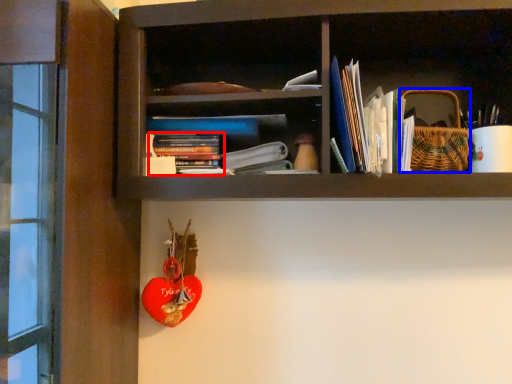
Question: Which point is closer to the camera, book (highlighted by a red box) or basket (highlighted by a blue box)?

Choices:
 (A) book
 (B) basket

Answer: (B)